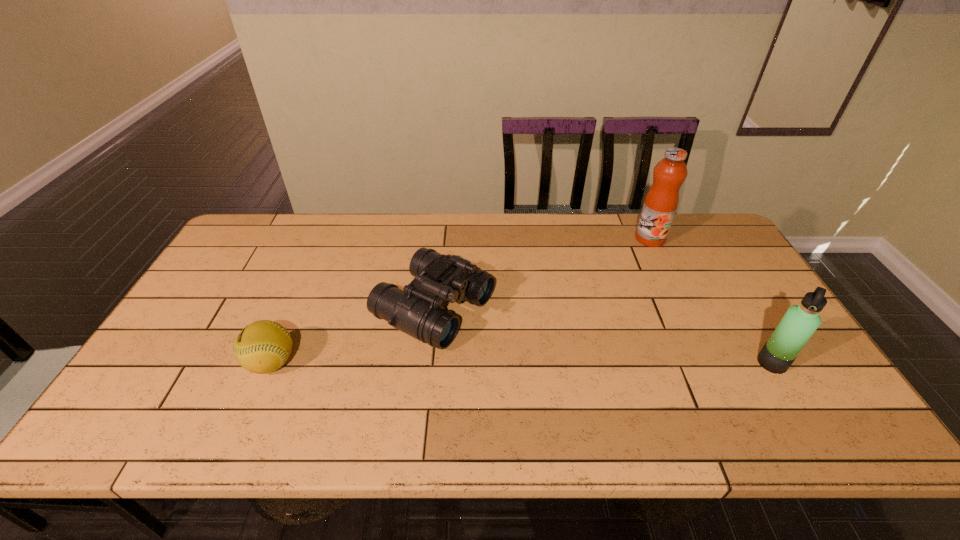
The height and width of the screenshot is (540, 960). Find the location of `softball`. softball is located at coordinates (262, 347).

The height and width of the screenshot is (540, 960). What are the coordinates of `the leftmost object` in the screenshot? It's located at (x=262, y=347).

This screenshot has width=960, height=540. Identify the location of thermos bottle. (799, 323).

Locate an element on the screen. The image size is (960, 540). the rightmost object is located at coordinates (799, 323).

I want to click on the tallest object, so point(660,204).

Find the location of `the third object from left to right`. the third object from left to right is located at coordinates (660, 204).

This screenshot has width=960, height=540. What are the coordinates of `the second object from left to right` in the screenshot? It's located at (417, 311).

Find the location of `the second shortest object`. the second shortest object is located at coordinates (417, 311).

Identify the location of blank area located on the logo side of the leftmost object. The width and height of the screenshot is (960, 540). (203, 363).

This screenshot has height=540, width=960. I want to click on vacant space positioned 0.070m on the logo side of the leftmost object, so click(218, 363).